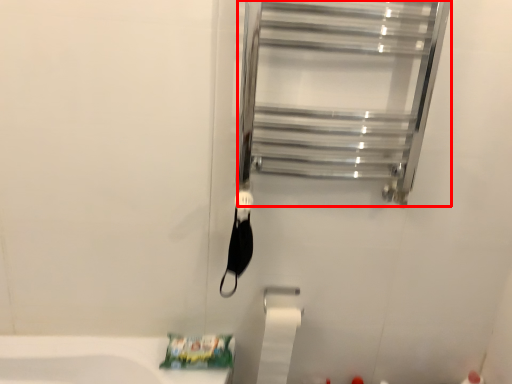
Question: From the image's perspective, where is glass door (annotated by the red box) located relative to toilet paper?

Choices:
 (A) above
 (B) below

Answer: (A)